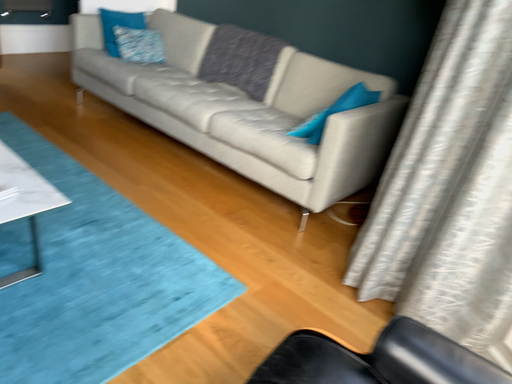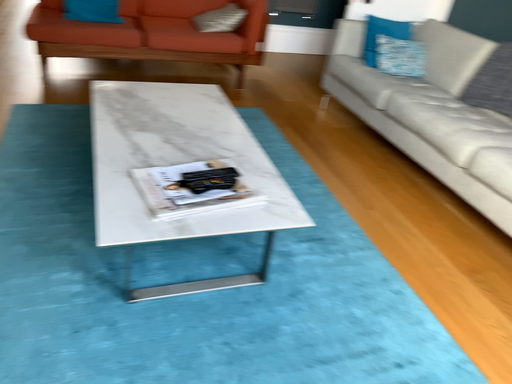
Question: Which way did the camera rotate in the video?

Choices:
 (A) rotated left
 (B) rotated right

Answer: (A)